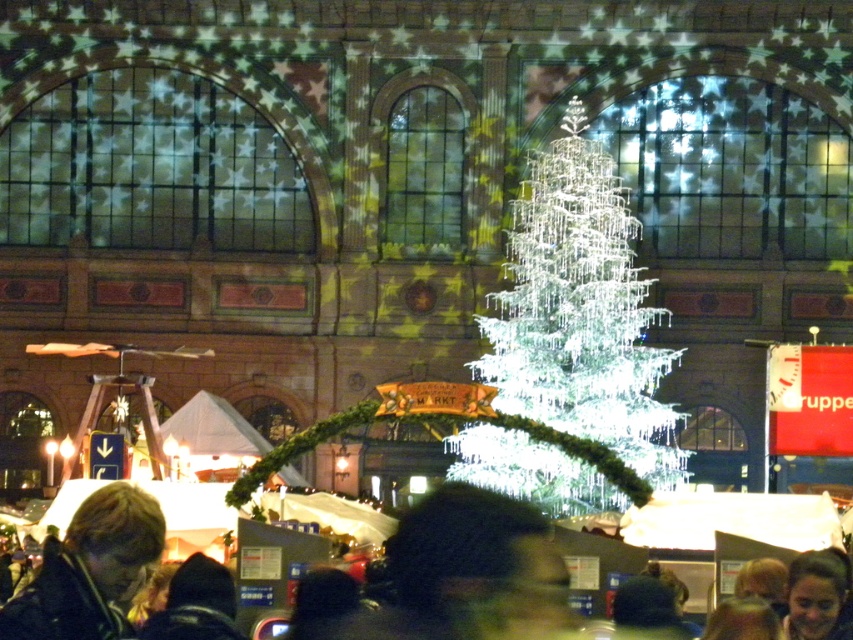
Question: Can you confirm if dark brown hair at lower center is thinner than matte black jacket at lower left?

Choices:
 (A) no
 (B) yes

Answer: (A)

Question: Which of the following is the closest to the observer?

Choices:
 (A) matte black jacket at lower left
 (B) icy white crystal at center
 (C) dark brown hair at lower center
 (D) smooth skin face at lower right

Answer: (C)

Question: Observing the image, what is the correct spatial positioning of icy white crystal at center in reference to dark brown hair at lower center?

Choices:
 (A) above
 (B) below

Answer: (A)

Question: Which object is closer to the camera taking this photo?

Choices:
 (A) icy white crystal at center
 (B) matte black jacket at lower left
 (C) smooth skin face at lower right
 (D) dark brown hair at lower center

Answer: (D)

Question: Can you confirm if matte black jacket at lower left is positioned to the left of smooth skin face at lower right?

Choices:
 (A) yes
 (B) no

Answer: (A)

Question: Estimate the real-world distances between objects in this image. Which object is farther from the matte black jacket at lower left?

Choices:
 (A) icy white crystal at center
 (B) smooth skin face at lower right
 (C) dark brown hair at lower center

Answer: (B)